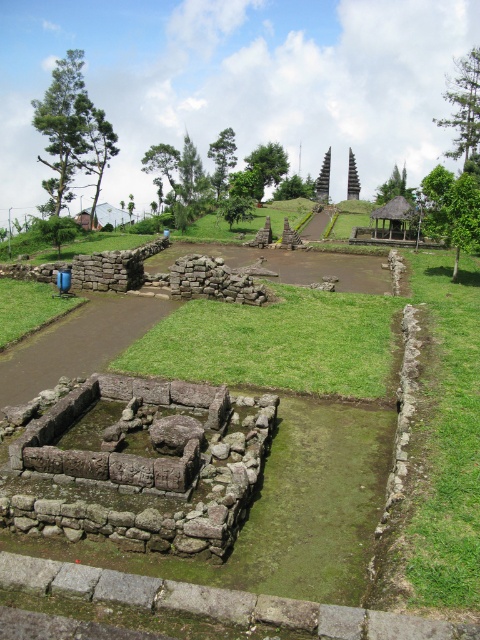
Is the position of green grass at center more distant than that of green grass at lower left?

No, green grass at center is in front of green grass at lower left.

Which is below, green grass at center or green grass at lower left?

green grass at center

Identify the location of green grass at center. (276, 342).

The image size is (480, 640). Identify the location of green grass at center. (276, 342).

Can you confirm if green mossy stone at center is smaller than green grass at center?

No, green mossy stone at center is not smaller than green grass at center.

Identify the location of green mossy stone at center. The image size is (480, 640). (294, 524).

This screenshot has height=640, width=480. Find the location of `green mossy stone at center`. green mossy stone at center is located at coordinates (294, 524).

Can you confirm if green grass at lower left is positioned above thatched wood hut at center?

No.

Does point (12, 337) come closer to viewer compared to point (393, 204)?

Yes, it is in front of point (393, 204).

Image resolution: width=480 pixels, height=640 pixels. I want to click on green grass at lower left, so [x=28, y=307].